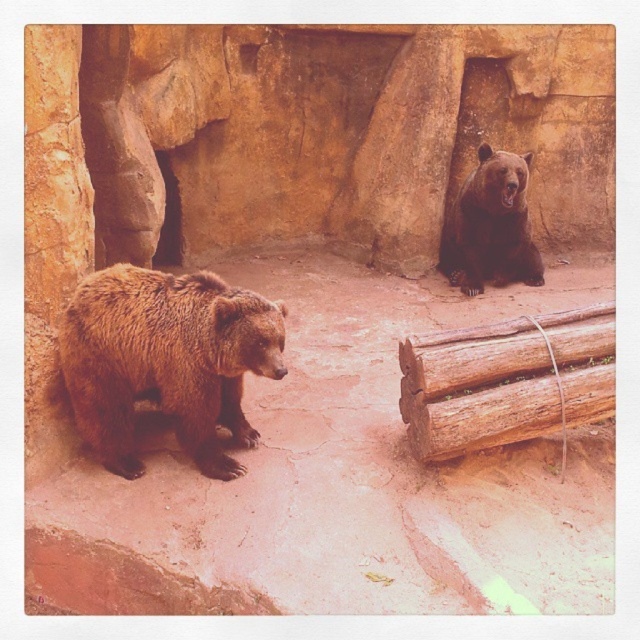
You are a zookeeper standing in front of the enclosure. You need to observe both the brown furry bear at left and the brown furry bear at upper right. Which bear is positioned closer to the entrance of the enclosure?

The brown furry bear at left is closer to the entrance of the enclosure because it is closer to the viewer, who is standing in front of the enclosure, than the brown furry bear at upper right.

You are a zookeeper planning to place a new feeding station in the enclosure. The feeding station requires a flat surface larger than the brown rough wood at lower right. Is there a suitable surface available near the brown furry bear at upper right?

The brown rough wood at lower right has a smaller size compared to brown furry bear at upper right, but the description does not provide information about the availability of a larger flat surface near the brown furry bear at upper right. Therefore, it is uncertain if there is a suitable surface available.